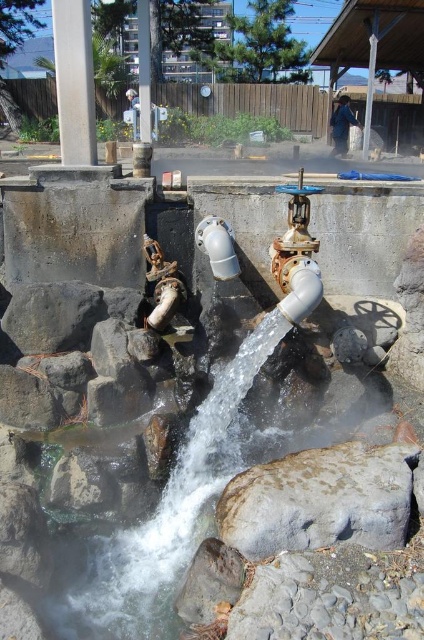
Question: Which point is farther to the camera?

Choices:
 (A) (326, 461)
 (B) (298, 212)
 (C) (343, 140)

Answer: (C)

Question: Which object appears closest to the camera in this image?

Choices:
 (A) white matte pipe at center
 (B) gray rough stone at center

Answer: (B)

Question: Is smooth concrete pole at upper left wider than metallic blue pipe at upper right?

Choices:
 (A) yes
 (B) no

Answer: (A)

Question: Is gray rough stone at center wider than smooth concrete pole at upper left?

Choices:
 (A) no
 (B) yes

Answer: (B)

Question: Is white matte pipe at center to the right of metallic blue pipe at upper right from the viewer's perspective?

Choices:
 (A) no
 (B) yes

Answer: (A)

Question: Which point is farther from the camera taking this photo?

Choices:
 (A) (231, 500)
 (B) (84, 92)

Answer: (B)